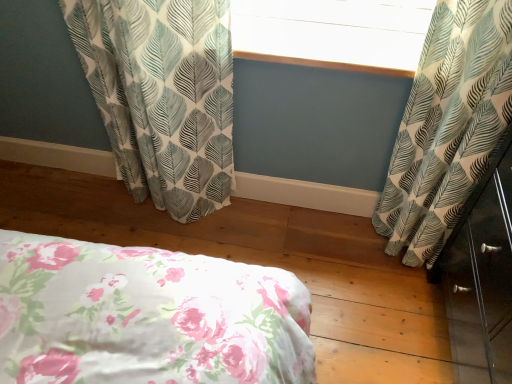
Question: Does white leaf-patterned curtain at left, marked as the first curtain in a left-to-right arrangement, have a larger size compared to white leaf-patterned curtain at right, the 2th curtain from the left?

Choices:
 (A) no
 (B) yes

Answer: (B)

Question: Is white leaf-patterned curtain at left, which is the second curtain in right-to-left order, behind white leaf-patterned curtain at right, which ranks as the first curtain in right-to-left order?

Choices:
 (A) no
 (B) yes

Answer: (B)

Question: Is white leaf-patterned curtain at left, which is the second curtain in right-to-left order, next to white leaf-patterned curtain at right, the 2th curtain from the left, and touching it?

Choices:
 (A) yes
 (B) no

Answer: (B)

Question: Can you confirm if white leaf-patterned curtain at left, marked as the first curtain in a left-to-right arrangement, is shorter than white leaf-patterned curtain at right, the 2th curtain from the left?

Choices:
 (A) yes
 (B) no

Answer: (A)

Question: Is white leaf-patterned curtain at left, marked as the first curtain in a left-to-right arrangement, at the right side of white leaf-patterned curtain at right, which ranks as the first curtain in right-to-left order?

Choices:
 (A) no
 (B) yes

Answer: (A)

Question: Do you think white leaf-patterned curtain at right, the 2th curtain from the left, is within white leaf-patterned curtain at left, marked as the first curtain in a left-to-right arrangement, or outside of it?

Choices:
 (A) outside
 (B) inside

Answer: (A)

Question: Considering the relative positions of white leaf-patterned curtain at right, the 2th curtain from the left, and white leaf-patterned curtain at left, which is the second curtain in right-to-left order, in the image provided, is white leaf-patterned curtain at right, the 2th curtain from the left, to the left or to the right of white leaf-patterned curtain at left, which is the second curtain in right-to-left order,?

Choices:
 (A) right
 (B) left

Answer: (A)

Question: Relative to white leaf-patterned curtain at left, marked as the first curtain in a left-to-right arrangement, is white leaf-patterned curtain at right, the 2th curtain from the left, in front or behind?

Choices:
 (A) front
 (B) behind

Answer: (A)

Question: Considering the positions of white leaf-patterned curtain at right, the 2th curtain from the left, and white leaf-patterned curtain at left, which is the second curtain in right-to-left order, in the image, is white leaf-patterned curtain at right, the 2th curtain from the left, wider or thinner than white leaf-patterned curtain at left, which is the second curtain in right-to-left order,?

Choices:
 (A) wide
 (B) thin

Answer: (A)

Question: Is white leaf-patterned curtain at left, which is the second curtain in right-to-left order, in front of or behind white textured window screen at upper center in the image?

Choices:
 (A) front
 (B) behind

Answer: (A)

Question: Considering the relative positions of white leaf-patterned curtain at left, which is the second curtain in right-to-left order, and white textured window screen at upper center in the image provided, is white leaf-patterned curtain at left, which is the second curtain in right-to-left order, to the left or to the right of white textured window screen at upper center?

Choices:
 (A) right
 (B) left

Answer: (B)

Question: From a real-world perspective, is white leaf-patterned curtain at left, marked as the first curtain in a left-to-right arrangement, above or below white textured window screen at upper center?

Choices:
 (A) above
 (B) below

Answer: (B)

Question: Based on their sizes in the image, would you say white leaf-patterned curtain at left, marked as the first curtain in a left-to-right arrangement, is bigger or smaller than white textured window screen at upper center?

Choices:
 (A) small
 (B) big

Answer: (B)

Question: From their relative heights in the image, would you say white textured window screen at upper center is taller or shorter than white leaf-patterned curtain at left, which is the second curtain in right-to-left order?

Choices:
 (A) tall
 (B) short

Answer: (B)

Question: Considering their positions, is white textured window screen at upper center located in front of or behind white leaf-patterned curtain at left, marked as the first curtain in a left-to-right arrangement?

Choices:
 (A) behind
 (B) front

Answer: (A)